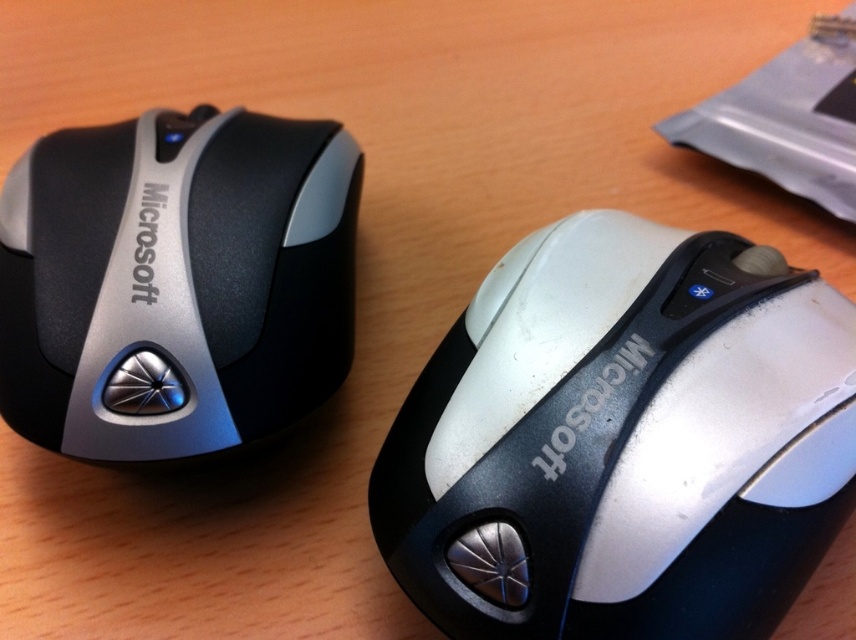
Question: Is white matte/black glossy mouse at center to the right of matte black mouse at left from the viewer's perspective?

Choices:
 (A) no
 (B) yes

Answer: (B)

Question: Can you confirm if white matte/black glossy mouse at center is bigger than matte black mouse at left?

Choices:
 (A) yes
 (B) no

Answer: (A)

Question: Can you confirm if white matte/black glossy mouse at center is smaller than matte black mouse at left?

Choices:
 (A) yes
 (B) no

Answer: (B)

Question: Which of the following is the closest to the observer?

Choices:
 (A) matte black mouse at left
 (B) white matte/black glossy mouse at center

Answer: (B)

Question: Which point is farther from the camera taking this photo?

Choices:
 (A) (28, 380)
 (B) (730, 625)

Answer: (A)

Question: Which object is closer to the camera taking this photo?

Choices:
 (A) white matte/black glossy mouse at center
 (B) matte black mouse at left

Answer: (A)